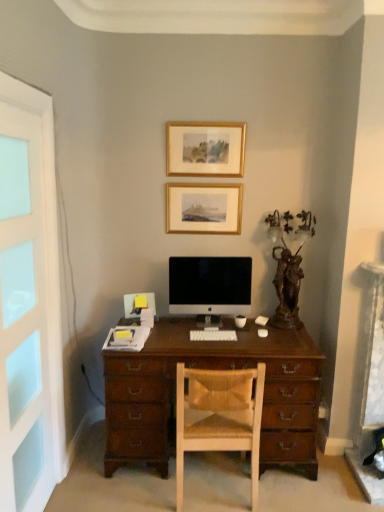
Question: Should I look upward or downward to see white plastic keyboard at center?

Choices:
 (A) up
 (B) down

Answer: (B)

Question: Does gold/glossy picture frame at upper center, which is counted as the second picture frame, starting from the bottom, come behind white frosted glass screen door at left?

Choices:
 (A) yes
 (B) no

Answer: (A)

Question: Is gold/glossy picture frame at upper center, which is counted as the second picture frame, starting from the bottom, shorter than white frosted glass screen door at left?

Choices:
 (A) no
 (B) yes

Answer: (B)

Question: Can you confirm if gold/glossy picture frame at upper center, which appears as the 1th picture frame when viewed from the top, is thinner than white frosted glass screen door at left?

Choices:
 (A) no
 (B) yes

Answer: (A)

Question: Is the surface of gold/glossy picture frame at upper center, which appears as the 1th picture frame when viewed from the top, in direct contact with white frosted glass screen door at left?

Choices:
 (A) no
 (B) yes

Answer: (A)

Question: From a real-world perspective, is gold/glossy picture frame at upper center, which appears as the 1th picture frame when viewed from the top, physically above white frosted glass screen door at left?

Choices:
 (A) no
 (B) yes

Answer: (B)

Question: Is gold/glossy picture frame at upper center, which is counted as the second picture frame, starting from the bottom, at the right side of white frosted glass screen door at left?

Choices:
 (A) no
 (B) yes

Answer: (B)

Question: Is gold/glossy picture frame at upper center, which is counted as the second picture frame, starting from the bottom, with satin black monitor at center?

Choices:
 (A) no
 (B) yes

Answer: (A)

Question: Does gold/glossy picture frame at upper center, which appears as the 1th picture frame when viewed from the top, have a greater width compared to satin black monitor at center?

Choices:
 (A) yes
 (B) no

Answer: (B)

Question: Is gold/glossy picture frame at upper center, which appears as the 1th picture frame when viewed from the top, turned away from satin black monitor at center?

Choices:
 (A) no
 (B) yes

Answer: (A)

Question: Would you say gold/glossy picture frame at upper center, which appears as the 1th picture frame when viewed from the top, contains satin black monitor at center?

Choices:
 (A) no
 (B) yes

Answer: (A)

Question: Is gold/glossy picture frame at upper center, which appears as the 1th picture frame when viewed from the top, in front of satin black monitor at center?

Choices:
 (A) no
 (B) yes

Answer: (A)

Question: From a real-world perspective, is gold/glossy picture frame at upper center, which appears as the 1th picture frame when viewed from the top, below satin black monitor at center?

Choices:
 (A) no
 (B) yes

Answer: (A)

Question: Is white frosted glass screen door at left positioned with its back to gold/glossy picture frame at upper center, which appears as the 1th picture frame when viewed from the top?

Choices:
 (A) yes
 (B) no

Answer: (B)